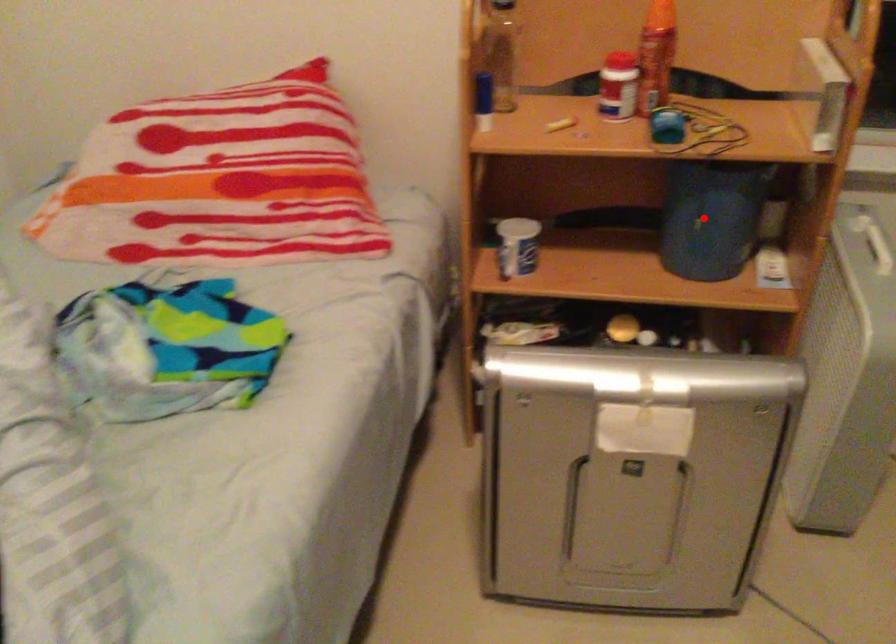
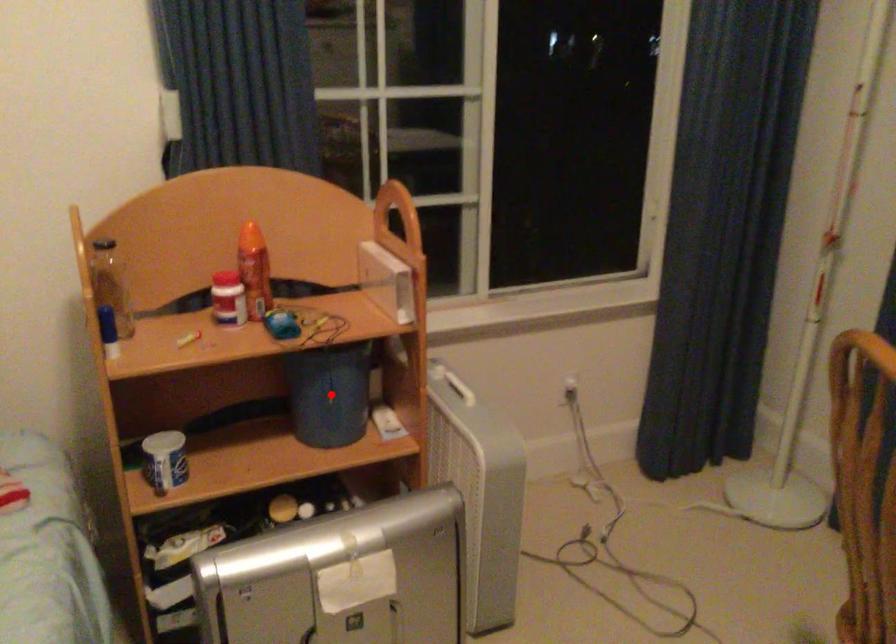
I am providing you with two images of the same scene from different viewpoints. A red point is marked on the first image and another point is marked on the second image. Is the red point in image1 aligned with the point shown in image2?

Yes